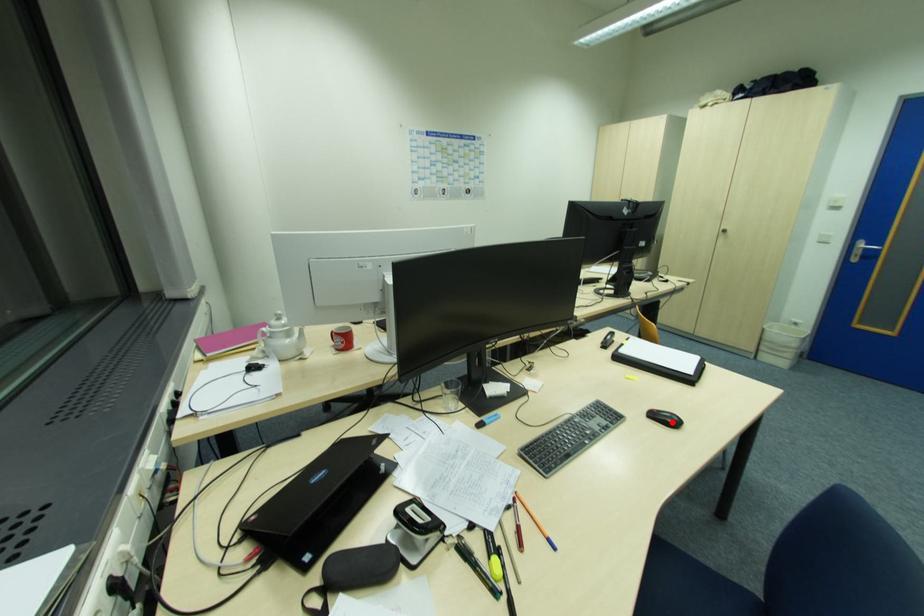
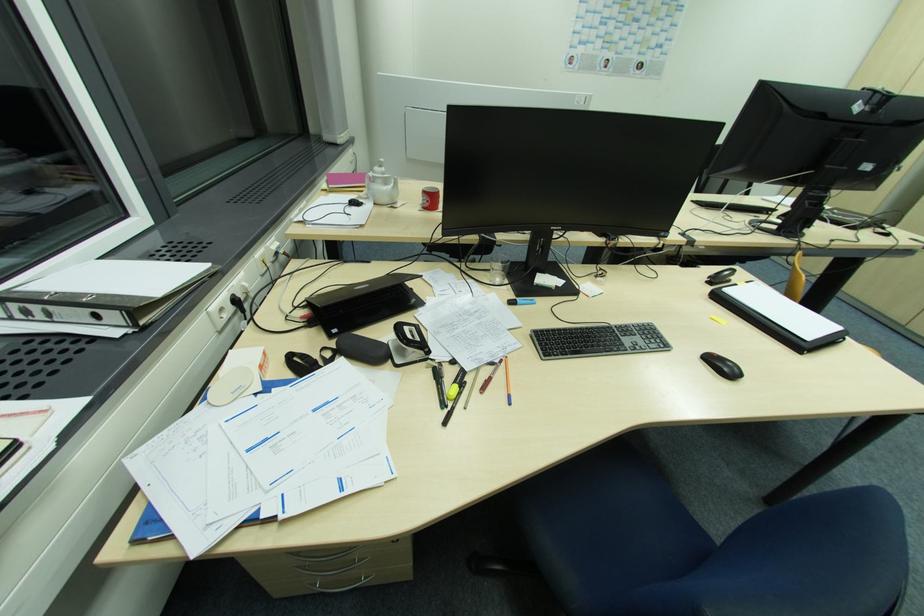
Question: I am providing you with two images of the same scene from different viewpoints. A red point is marked on the first image. Can you still see the location of the red point in image 2?

Choices:
 (A) Yes
 (B) No

Answer: (A)